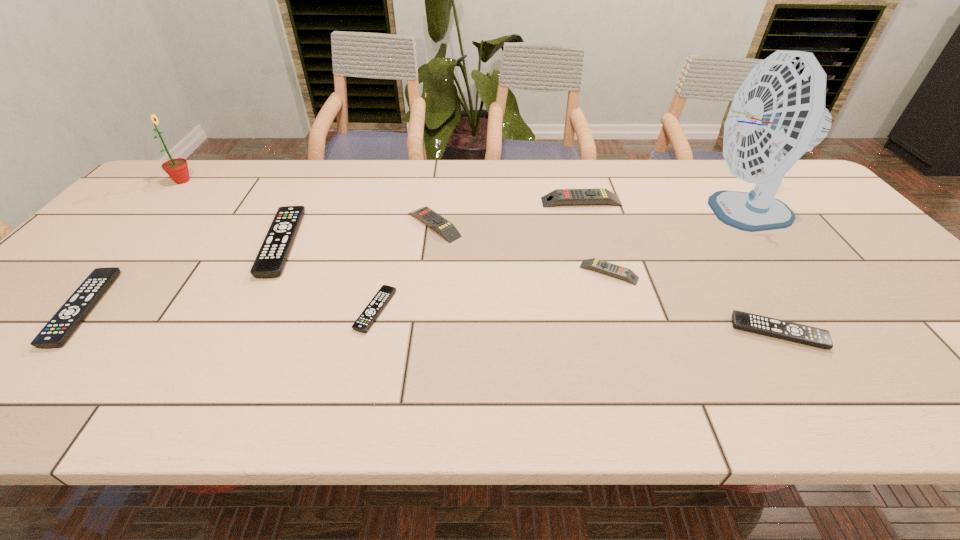
Identify the location of fan. (778, 113).

Identify the location of the second tallest object. Image resolution: width=960 pixels, height=540 pixels. (177, 169).

Image resolution: width=960 pixels, height=540 pixels. Find the location of `green sunflower`. green sunflower is located at coordinates (177, 169).

Locate an element on the screen. the farthest yellow remote control is located at coordinates pos(599,195).

The height and width of the screenshot is (540, 960). I want to click on the biggest yellow remote control, so click(599, 195).

Locate an element on the screen. Image resolution: width=960 pixels, height=540 pixels. the biggest black remote control is located at coordinates click(x=271, y=258).

Identify the location of the second remote control from left to right. The height and width of the screenshot is (540, 960). (271, 258).

The width and height of the screenshot is (960, 540). I want to click on the leftmost yellow remote control, so click(446, 229).

Find the location of `the second smallest yellow remote control`. the second smallest yellow remote control is located at coordinates (446, 229).

Locate an element on the screen. the leftmost remote control is located at coordinates click(62, 325).